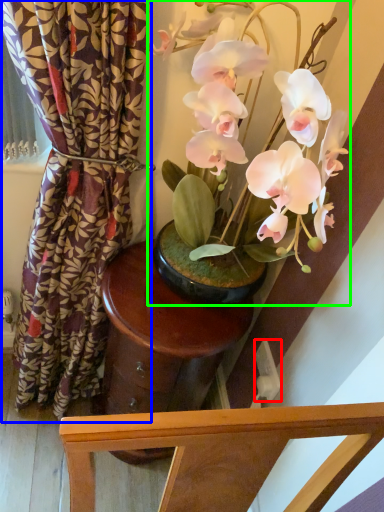
Question: Which object is the farthest from power outlet (highlighted by a red box)? Choose among these: curtain (highlighted by a blue box) or houseplant (highlighted by a green box).

Choices:
 (A) curtain
 (B) houseplant

Answer: (A)